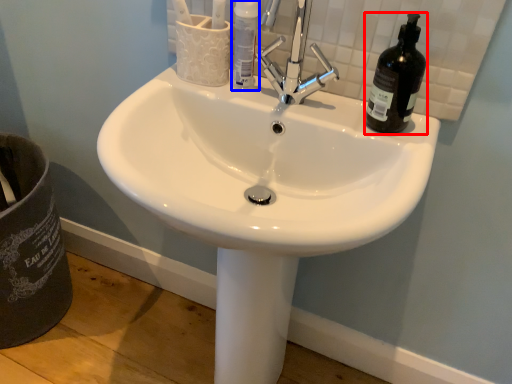
Question: Which object appears farthest to the camera in this image, beer bottle (highlighted by a red box) or bottle (highlighted by a blue box)?

Choices:
 (A) beer bottle
 (B) bottle

Answer: (B)